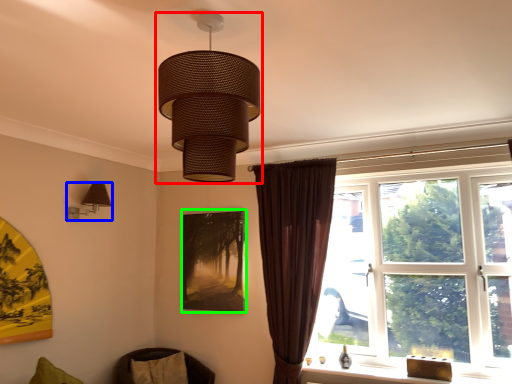
Question: Based on their relative distances, which object is farther from lamp (highlighted by a red box)? Choose from lamp (highlighted by a blue box) and picture frame (highlighted by a green box).

Choices:
 (A) lamp
 (B) picture frame

Answer: (B)